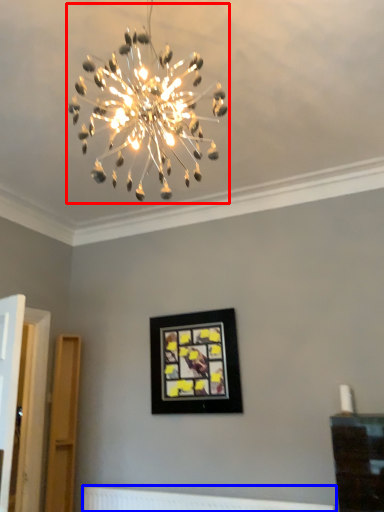
Question: Which point is further to the camera, lamp (highlighted by a red box) or radiator (highlighted by a blue box)?

Choices:
 (A) lamp
 (B) radiator

Answer: (B)